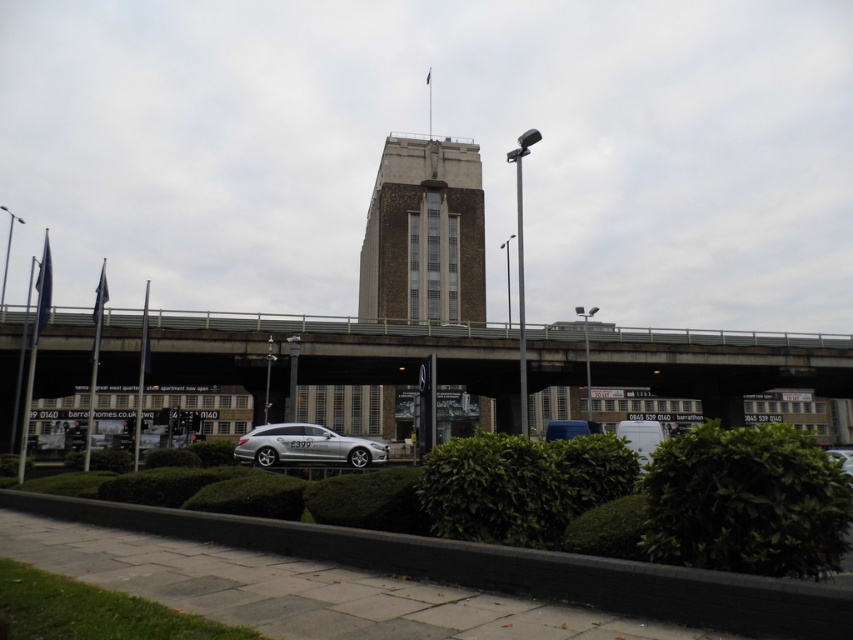
Question: Based on their relative distances, which object is farther from the green hedge at center?

Choices:
 (A) silver metallic car at lower right
 (B) silver metallic car at center
 (C) metallic silver car at center
 (D) concrete bridge at center

Answer: (D)

Question: Which object appears closest to the camera in this image?

Choices:
 (A) metallic silver car at center
 (B) silver metallic car at center

Answer: (B)

Question: Can you confirm if silver metallic car at center is positioned below metallic silver car at center?

Choices:
 (A) yes
 (B) no

Answer: (B)

Question: Can you confirm if metallic silver car at center is smaller than silver metallic car at lower right?

Choices:
 (A) no
 (B) yes

Answer: (A)

Question: Which object appears closest to the camera in this image?

Choices:
 (A) concrete bridge at center
 (B) silver metallic car at lower right
 (C) silver metallic car at center

Answer: (B)

Question: Is concrete bridge at center positioned behind silver metallic car at lower right?

Choices:
 (A) yes
 (B) no

Answer: (A)